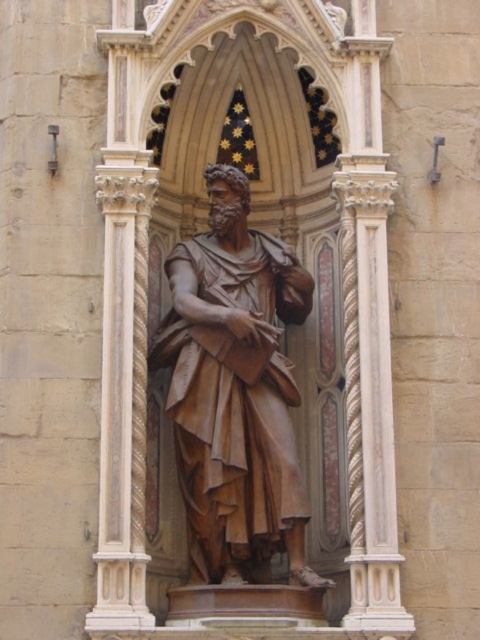
Question: Which object appears farthest from the camera in this image?

Choices:
 (A) white marble column at center
 (B) brown polished wood statue at center

Answer: (B)

Question: In this image, where is brown polished wood statue at center located relative to white marble column at center?

Choices:
 (A) above
 (B) below

Answer: (B)

Question: Which point is closer to the camera?

Choices:
 (A) brown polished wood statue at center
 (B) white marble column at center

Answer: (B)

Question: Which point is closer to the camera?

Choices:
 (A) brown polished wood statue at center
 (B) white marble column at center

Answer: (B)

Question: Does brown polished wood statue at center appear on the left side of white marble column at center?

Choices:
 (A) yes
 (B) no

Answer: (A)

Question: Does brown polished wood statue at center have a larger size compared to white marble column at center?

Choices:
 (A) no
 (B) yes

Answer: (B)